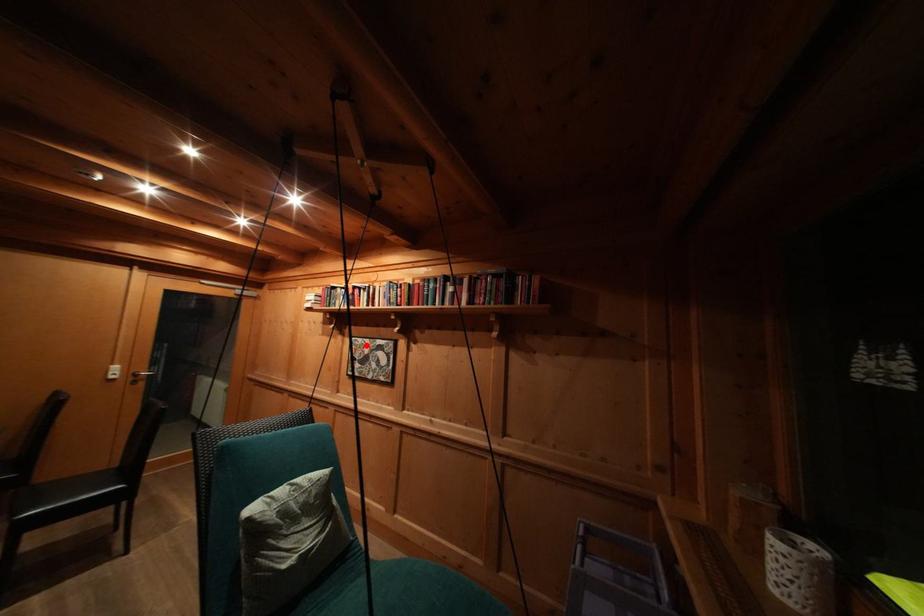
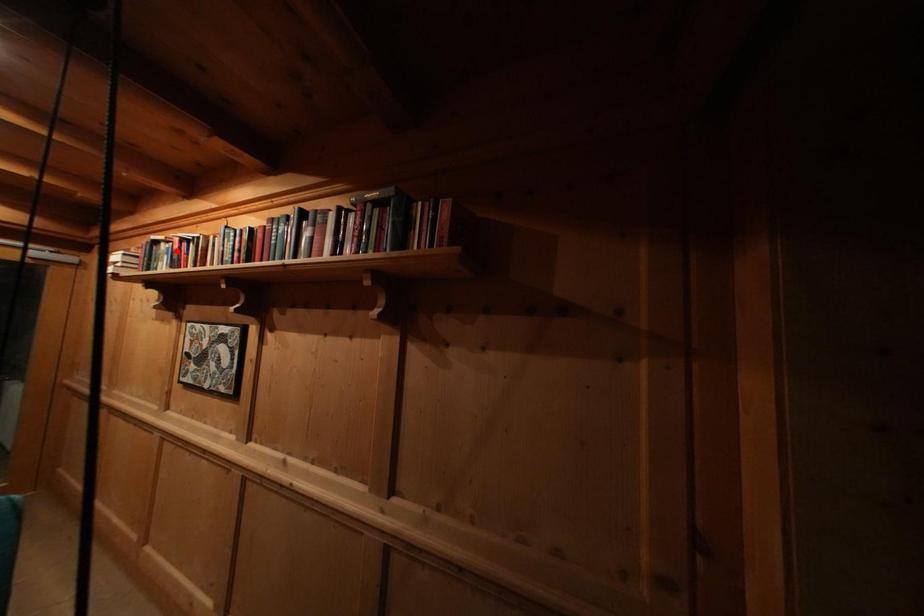
I am providing you with two images of the same scene from different viewpoints. A red point is marked on the first image and another point is marked on the second image. Are the points marked in image1 and image2 representing the same 3D position?

No